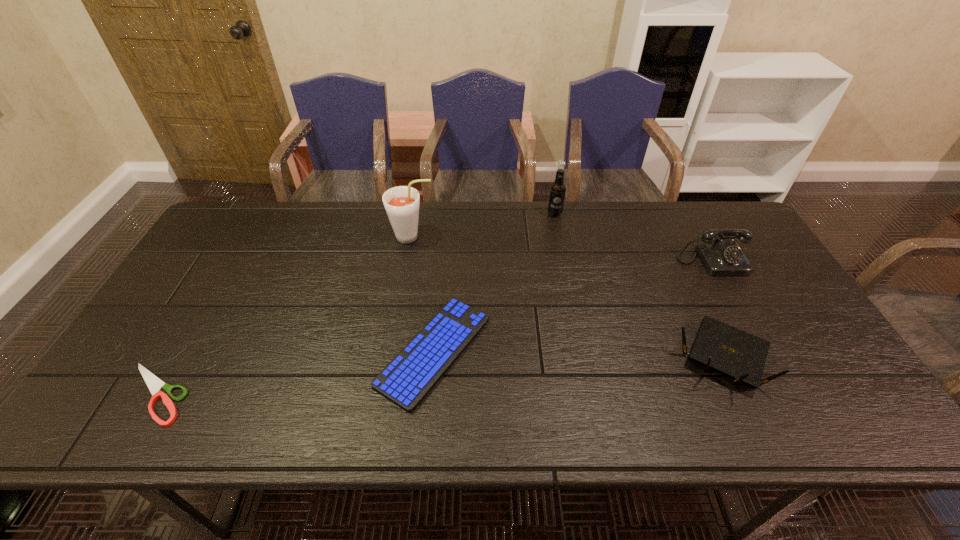
Where is `free point located on the dial of the telephone`? The width and height of the screenshot is (960, 540). free point located on the dial of the telephone is located at coordinates (756, 343).

In order to click on free space located 0.220m on the back of the router in this screenshot , I will do `click(679, 262)`.

You are a GUI agent. You are given a task and a screenshot of the screen. Output one action in this format:
    pyautogui.click(x=<x>, y=<y>)
    Task: Click on the free space located on the left of the computer keyboard
    This screenshot has height=540, width=960.
    Given the screenshot: What is the action you would take?
    pyautogui.click(x=227, y=352)

Locate an element on the screen. The height and width of the screenshot is (540, 960). blank space located 0.050m on the back of the scissors is located at coordinates (181, 347).

What are the coordinates of `computer keyboard at the near edge` in the screenshot? It's located at (416, 369).

At what (x,y) coordinates should I click in order to perform the action: click on scissors situated at the near edge. Please return your answer as a coordinate pair (x, y). Looking at the image, I should click on (154, 384).

Where is `object that is at the left edge`? The height and width of the screenshot is (540, 960). object that is at the left edge is located at coordinates (154, 384).

Locate an element on the screen. The height and width of the screenshot is (540, 960). telephone that is at the right edge is located at coordinates click(x=721, y=256).

The height and width of the screenshot is (540, 960). In order to click on router that is at the right edge in this screenshot , I will do `click(734, 353)`.

Image resolution: width=960 pixels, height=540 pixels. Identify the location of object at the near left corner. (154, 384).